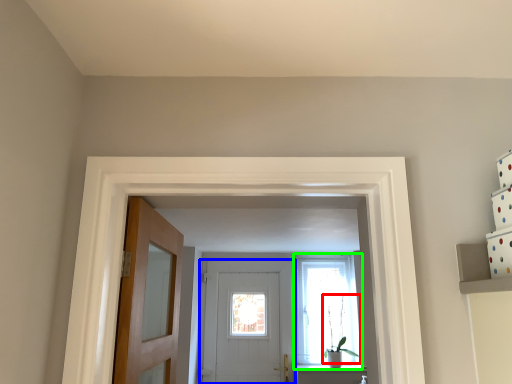
Question: Considering the real-world distances, which object is farthest from plant (highlighted by a red box)? door (highlighted by a blue box) or window (highlighted by a green box)?

Choices:
 (A) door
 (B) window

Answer: (A)